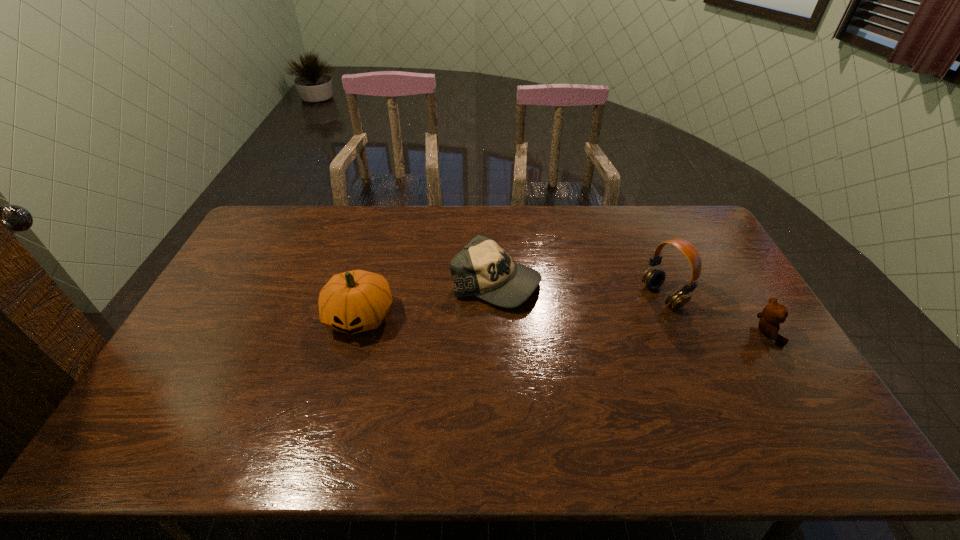
This screenshot has height=540, width=960. I want to click on vacant space located 0.310m on the front-facing side of the baseball cap, so pyautogui.click(x=628, y=350).

The width and height of the screenshot is (960, 540). Identify the location of vacant area situated on the front-facing side of the baseball cap. (641, 357).

What are the coordinates of `object present at the right edge` in the screenshot? It's located at (774, 313).

This screenshot has width=960, height=540. I want to click on free region at the far edge of the desktop, so click(317, 237).

Where is `free region at the near edge of the desktop`? The height and width of the screenshot is (540, 960). free region at the near edge of the desktop is located at coordinates (631, 396).

You are a GUI agent. You are given a task and a screenshot of the screen. Output one action in this format:
    pyautogui.click(x=<x>, y=<y>)
    Task: Click on the vacant space at the left edge of the desktop
    
    Given the screenshot: What is the action you would take?
    pyautogui.click(x=253, y=302)

The height and width of the screenshot is (540, 960). Identify the location of vacant space at the right edge of the desktop. (745, 355).

Locate an element on the screen. This screenshot has width=960, height=540. vacant space at the far left corner is located at coordinates (286, 243).

Identify the location of blank region between the third shortest object and the third object from right to left. This screenshot has width=960, height=540. (428, 300).

This screenshot has width=960, height=540. I want to click on vacant space that's between the gourd and the rightmost object, so click(563, 325).